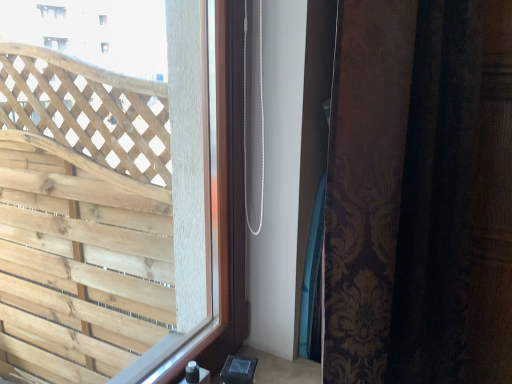
What do you see at coordinates (420, 194) in the screenshot? I see `brown textured curtain at right` at bounding box center [420, 194].

You are a GUI agent. You are given a task and a screenshot of the screen. Output one action in this format:
    pyautogui.click(x=<x>, y=<y>)
    Task: Click on the brown textured curtain at right
    The image size is (512, 384).
    Given the screenshot: What is the action you would take?
    click(420, 194)

Find the location of a particular element. This screenshot has height=384, width=512. brown textured curtain at right is located at coordinates (420, 194).